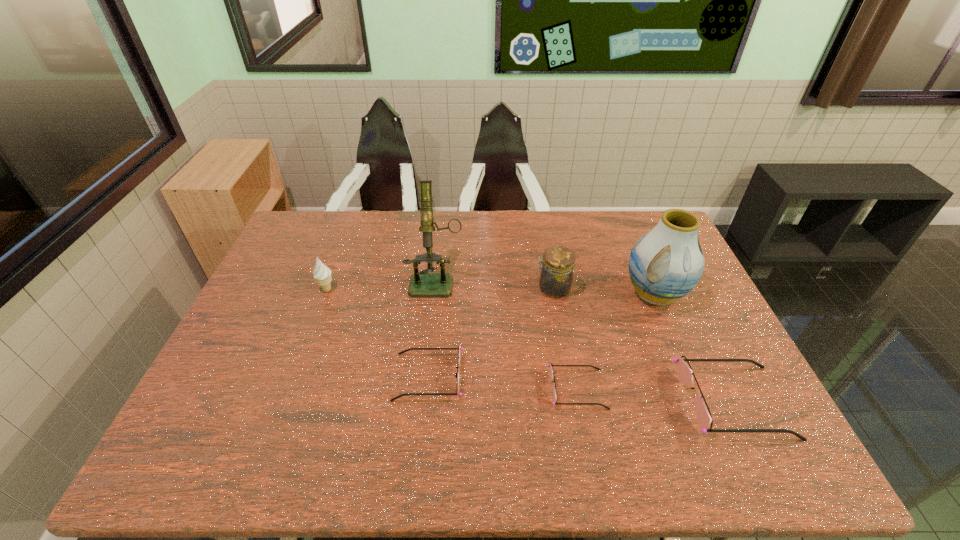
Where is `free space between the vase and the third shortest object`? This screenshot has height=540, width=960. free space between the vase and the third shortest object is located at coordinates (693, 348).

Identify the location of free area in between the icecream and the sixth shortest object. The height and width of the screenshot is (540, 960). (491, 292).

Locate an element on the screen. The image size is (960, 540). empty space between the shortest object and the rightmost sunglasses is located at coordinates (655, 395).

Where is `vacant space that's between the leftmost object and the microscope`? This screenshot has height=540, width=960. vacant space that's between the leftmost object and the microscope is located at coordinates (382, 285).

The height and width of the screenshot is (540, 960). I want to click on vacant area that lies between the jar and the rightmost sunglasses, so click(642, 346).

The width and height of the screenshot is (960, 540). Find the location of `vacant space that's between the icecream and the sixth tallest object`. vacant space that's between the icecream and the sixth tallest object is located at coordinates (378, 333).

This screenshot has width=960, height=540. Find the location of `object identified as the closest to the leftmost object`. object identified as the closest to the leftmost object is located at coordinates (422, 284).

Find the location of a particular element. This screenshot has width=960, height=540. object identified as the fifth closest to the sixth shortest object is located at coordinates (459, 349).

Identify which sunglasses is the second nearest to the third shortest object. Please provide its 2D coordinates. Your answer should be formatted as a tuple, i.e. [(x, y)], where the tuple contains the x and y coordinates of a point satisfying the conditions above.

[(459, 349)]

You are a GUI agent. You are given a task and a screenshot of the screen. Output one action in this format:
    pyautogui.click(x=<x>, y=<y>)
    Task: Click on the second closest sunglasses to the microscope
    Image resolution: width=960 pixels, height=540 pixels.
    Given the screenshot: What is the action you would take?
    pyautogui.click(x=554, y=403)